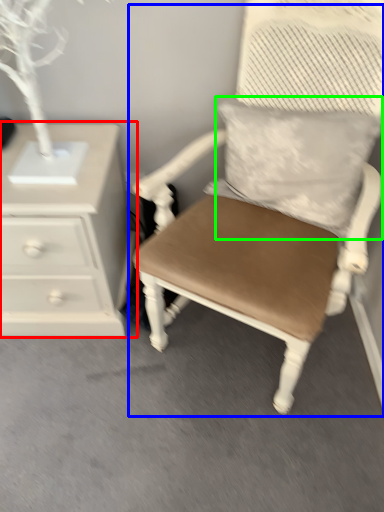
Question: Estimate the real-world distances between objects in this image. Which object is farther from chest of drawers (highlighted by a red box), chair (highlighted by a blue box) or pillow (highlighted by a green box)?

Choices:
 (A) chair
 (B) pillow

Answer: (B)